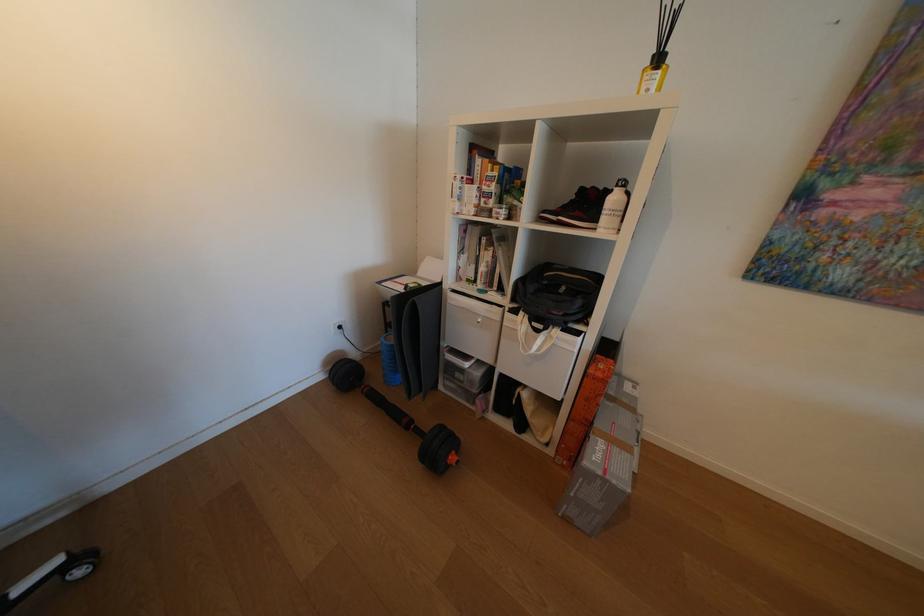
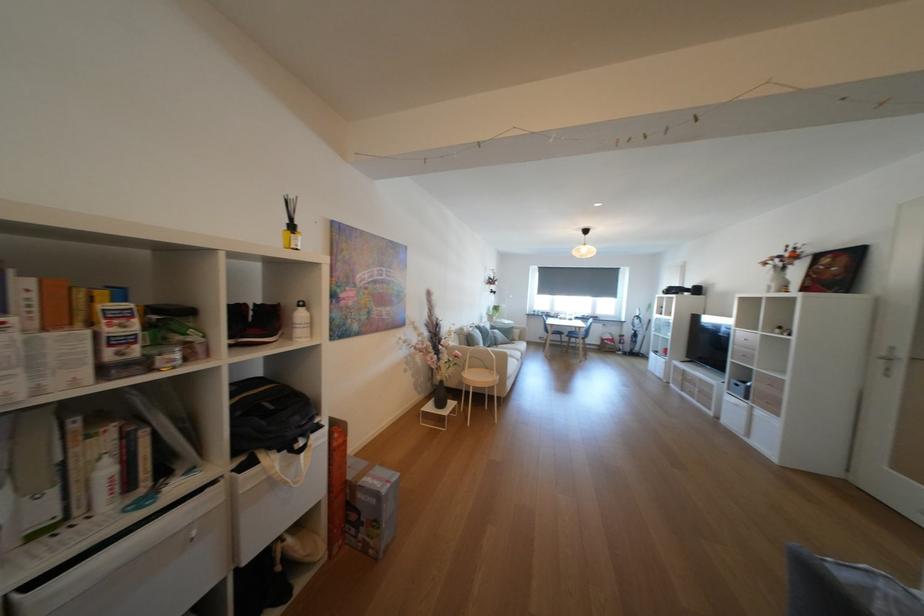
Question: The images are taken continuously from a first-person perspective. In which direction is your viewpoint rotating?

Choices:
 (A) Left
 (B) Right
 (C) Up
 (D) Down

Answer: (B)